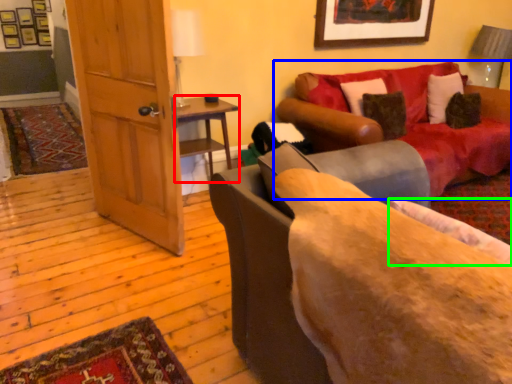
Question: Which object is positioned farthest from table (highlighted by a red box)? Select from studio couch (highlighted by a blue box) and pillow (highlighted by a green box).

Choices:
 (A) studio couch
 (B) pillow

Answer: (B)